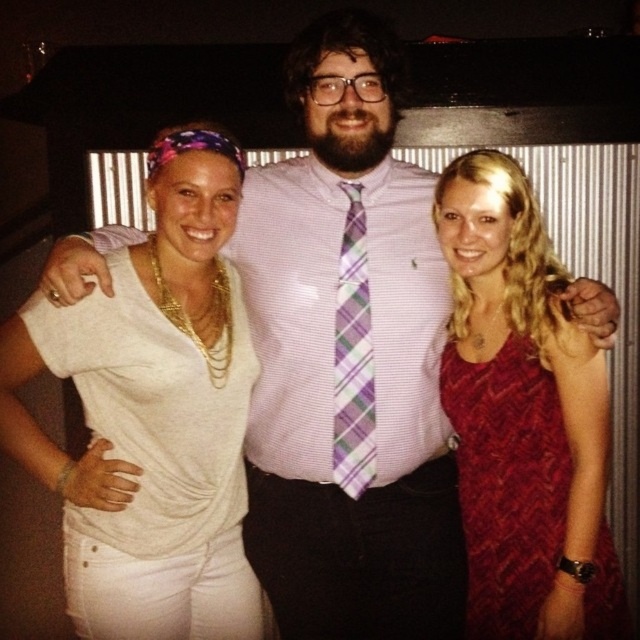
Is point (120, 406) more distant than point (358, 266)?

No, it is not.

Can you confirm if white matte shirt at center is bigger than plaid fabric tie at center?

Yes, white matte shirt at center is bigger than plaid fabric tie at center.

Between point (132, 362) and point (365, 285), which one is positioned in front?

Point (132, 362) is more forward.

Identify the location of white matte shirt at center. Image resolution: width=640 pixels, height=640 pixels. (152, 416).

Who is positioned more to the left, white matte shirt at center or matte red dress at center?

From the viewer's perspective, white matte shirt at center appears more on the left side.

Does white matte shirt at center appear on the left side of matte red dress at center?

Indeed, white matte shirt at center is positioned on the left side of matte red dress at center.

Does point (195, 400) come closer to viewer compared to point (472, 540)?

That is True.

Where is `white matte shirt at center`? white matte shirt at center is located at coordinates (152, 416).

Does matte red dress at center appear on the left side of plaid fabric tie at center?

In fact, matte red dress at center is to the right of plaid fabric tie at center.

Find the location of a particular element. Image resolution: width=640 pixels, height=640 pixels. matte red dress at center is located at coordinates (508, 483).

The width and height of the screenshot is (640, 640). I want to click on matte red dress at center, so click(x=508, y=483).